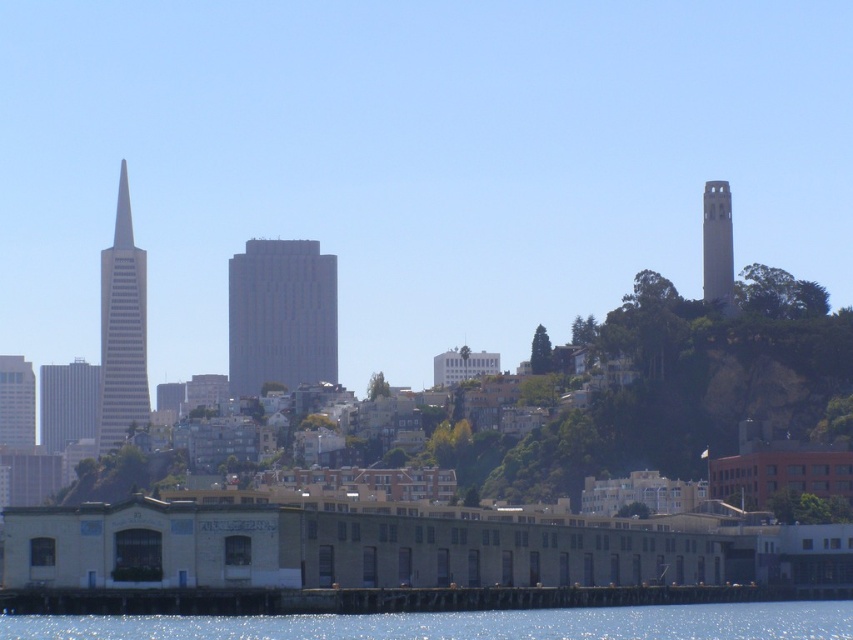
You are standing at the waterfront looking at the cityscape. There are two points marked in the image. The first point is at coordinates point (136,310) and the second point is at coordinates point (721,264). Which point is closer to you?

Point (136,310) is closer to you because it is further to the camera than point (721,264).

You are an urban planner assessing the city skyline. Which of the two structures, the gray glass skyscraper at left or the smooth concrete tower at upper right, has a taller height?

The gray glass skyscraper at left has a greater height compared to the smooth concrete tower at upper right, so the gray glass skyscraper at left is taller.

Looking at this image, you are a drone operator trying to navigate between the matte gray skyscraper at left and the smooth glass spire at upper left. Which object is closer to the ground?

The matte gray skyscraper at left is positioned under the smooth glass spire at upper left, so it is closer to the ground.